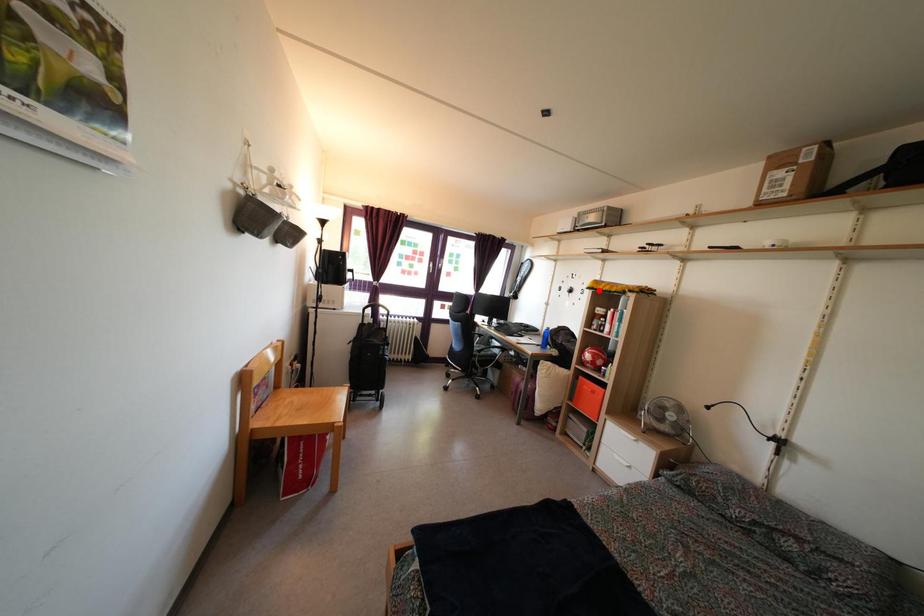
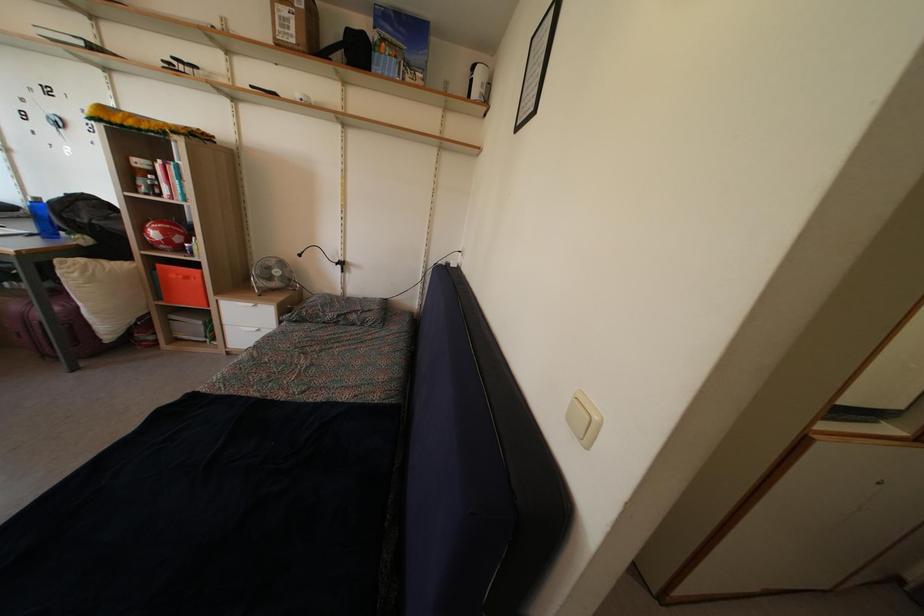
The point at the highlighted location is marked in the first image. Where is the corresponding point in the second image?

(106, 116)